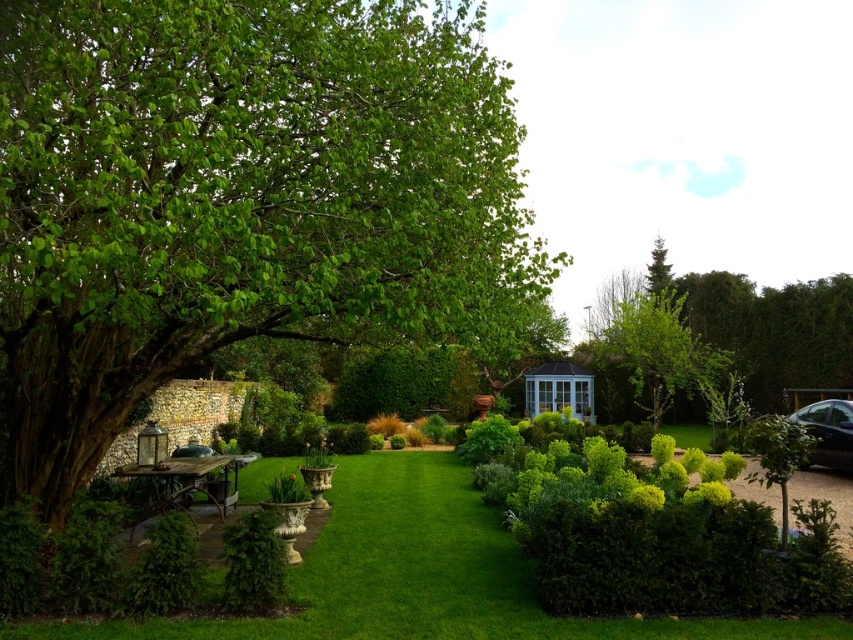
Consider the image. Can you confirm if green leafy tree at upper right is positioned below rustic wood picnic table at lower left?

Actually, green leafy tree at upper right is above rustic wood picnic table at lower left.

Does point (846, 355) lie behind point (233, 464)?

Yes, point (846, 355) is behind point (233, 464).

What are the coordinates of `green leafy tree at upper right` in the screenshot? It's located at (717, 340).

Measure the distance between point (631, 298) and camera.

32.43 meters

How distant is green leafy tree at center-right from rustic wood picnic table at lower left?

green leafy tree at center-right and rustic wood picnic table at lower left are 19.21 meters apart from each other.

Between point (727, 376) and point (154, 470), which one is positioned behind?

Point (727, 376)

The image size is (853, 640). I want to click on green leafy tree at center-right, so click(660, 352).

At what (x,y) coordinates should I click in order to perform the action: click on green leafy tree at upper right. Please return your answer as a coordinate pair (x, y). The image size is (853, 640). Looking at the image, I should click on (717, 340).